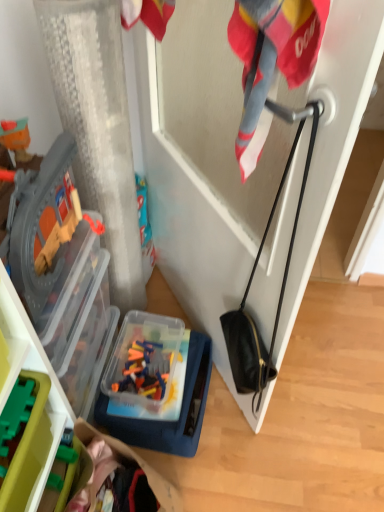
Question: Does translucent plastic container at lower center have a smaller size compared to green plastic toy blocks at lower left?

Choices:
 (A) no
 (B) yes

Answer: (A)

Question: Does translucent plastic container at lower center have a lesser height compared to green plastic toy blocks at lower left?

Choices:
 (A) yes
 (B) no

Answer: (B)

Question: Is translucent plastic container at lower center at the left side of green plastic toy blocks at lower left?

Choices:
 (A) yes
 (B) no

Answer: (B)

Question: Is the depth of translucent plastic container at lower center less than that of green plastic toy blocks at lower left?

Choices:
 (A) yes
 (B) no

Answer: (B)

Question: Considering the relative sizes of translucent plastic container at lower center and green plastic toy blocks at lower left in the image provided, is translucent plastic container at lower center thinner than green plastic toy blocks at lower left?

Choices:
 (A) no
 (B) yes

Answer: (A)

Question: Considering the relative sizes of translucent plastic container at lower center and green plastic toy blocks at lower left in the image provided, is translucent plastic container at lower center wider than green plastic toy blocks at lower left?

Choices:
 (A) no
 (B) yes

Answer: (B)

Question: Can you confirm if green plastic toy blocks at lower left is smaller than translucent plastic container at lower center?

Choices:
 (A) no
 (B) yes

Answer: (B)

Question: Can you confirm if green plastic toy blocks at lower left is positioned to the left of translucent plastic container at lower center?

Choices:
 (A) no
 (B) yes

Answer: (B)

Question: Are green plastic toy blocks at lower left and translucent plastic container at lower center far apart?

Choices:
 (A) yes
 (B) no

Answer: (B)

Question: Are green plastic toy blocks at lower left and translucent plastic container at lower center beside each other?

Choices:
 (A) yes
 (B) no

Answer: (B)

Question: Is the position of green plastic toy blocks at lower left more distant than that of translucent plastic container at lower center?

Choices:
 (A) no
 (B) yes

Answer: (A)

Question: Can you confirm if green plastic toy blocks at lower left is positioned to the right of translucent plastic container at lower center?

Choices:
 (A) no
 (B) yes

Answer: (A)

Question: Is translucent plastic container at lower center in front of or behind green plastic toy blocks at lower left in the image?

Choices:
 (A) behind
 (B) front

Answer: (A)